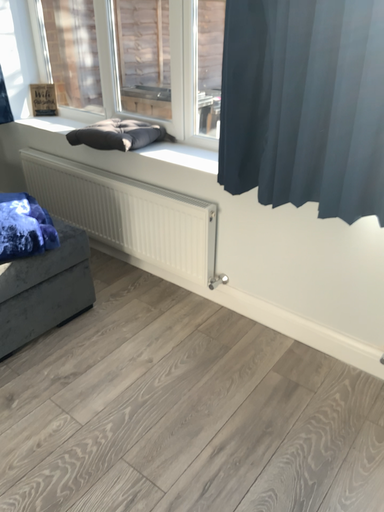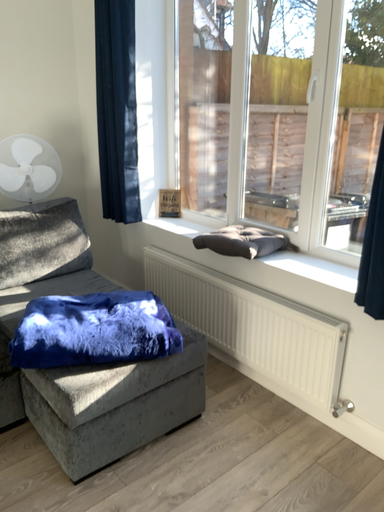
Question: How did the camera likely rotate when shooting the video?

Choices:
 (A) rotated right
 (B) rotated left

Answer: (B)